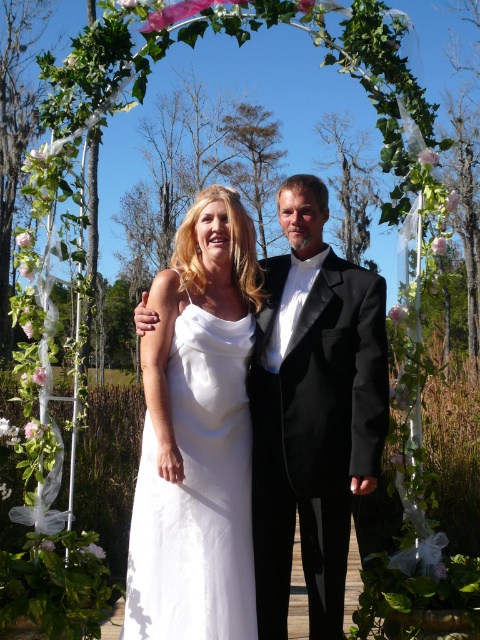
Question: Can you confirm if white satin dress at center is bigger than black satin tuxedo at center?

Choices:
 (A) yes
 (B) no

Answer: (B)

Question: Is white satin dress at center to the right of black satin tuxedo at center from the viewer's perspective?

Choices:
 (A) yes
 (B) no

Answer: (B)

Question: Where is white satin dress at center located in relation to black satin tuxedo at center in the image?

Choices:
 (A) left
 (B) right

Answer: (A)

Question: Which point is farther to the camera?

Choices:
 (A) (183, 438)
 (B) (381, 328)

Answer: (A)

Question: Among these points, which one is farthest from the camera?

Choices:
 (A) (126, 596)
 (B) (309, 428)

Answer: (A)